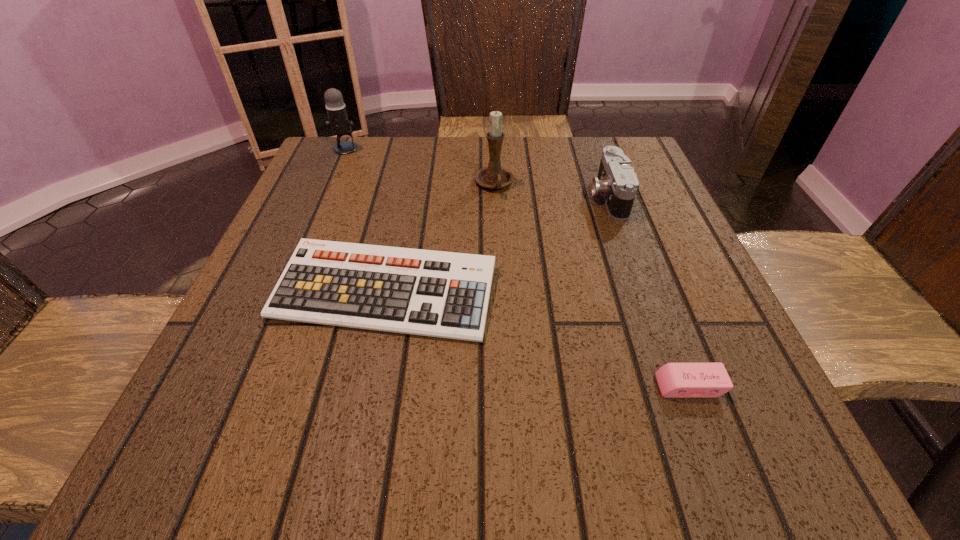
Locate an element on the screen. This screenshot has height=540, width=960. vacant space that satisfies the following two spatial constraints: 1. on the front side of the computer keyboard; 2. on the right side of the microphone is located at coordinates (285, 292).

I want to click on vacant position in the image that satisfies the following two spatial constraints: 1. on the side of the nearest object with the handle; 2. on the left side of the candle holder, so click(x=503, y=386).

At what (x,y) coordinates should I click in order to perform the action: click on free point that satisfies the following two spatial constraints: 1. on the front side of the computer keyboard; 2. on the left side of the eraser. Please return your answer as a coordinate pair (x, y). Image resolution: width=960 pixels, height=540 pixels. Looking at the image, I should click on (366, 386).

Locate an element on the screen. Image resolution: width=960 pixels, height=540 pixels. blank area in the image that satisfies the following two spatial constraints: 1. on the front side of the microphone; 2. on the right side of the eraser is located at coordinates (245, 386).

Find the location of `vacant region that satisfies the following two spatial constraints: 1. on the side of the candle holder with the handle; 2. on the right side of the eraser`. vacant region that satisfies the following two spatial constraints: 1. on the side of the candle holder with the handle; 2. on the right side of the eraser is located at coordinates (503, 386).

The image size is (960, 540). I want to click on free space that satisfies the following two spatial constraints: 1. on the lens of the nearest object; 2. on the right side of the third shortest object, so click(675, 386).